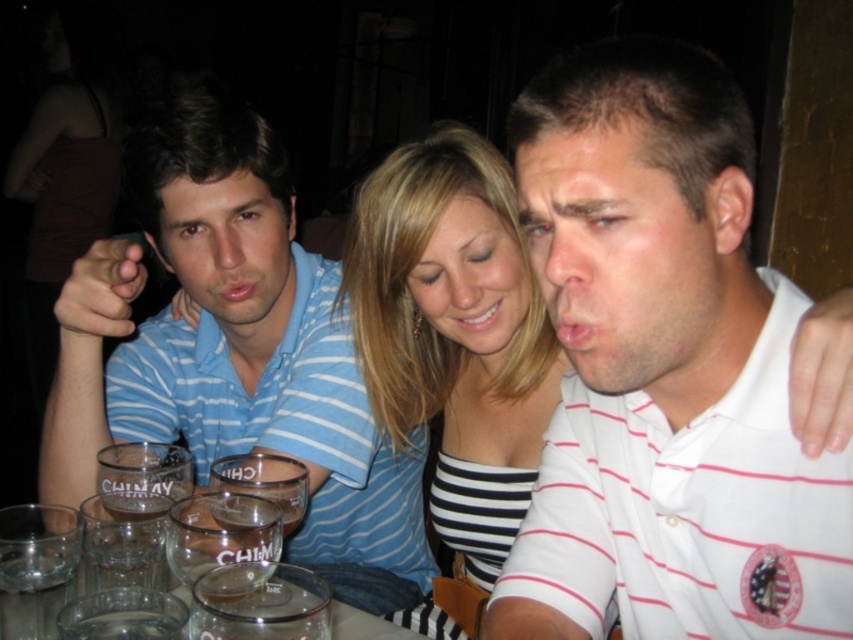
You are a photographer at this gathering. You want to take a photo of the white striped polo shirt at right and the transparent glass at lower left. Which object is wider?

The white striped polo shirt at right is wider than the transparent glass at lower left.

You are a bartender who needs to place a new drink order on the table between the transparent glass at lower left and the clear glass shot glass at lower center. The drink requires 5 inches of space. Can you fit it there?

The transparent glass at lower left and clear glass shot glass at lower center are 4.49 inches apart from each other. Since the required space is 5 inches, the drink cannot be placed there as there is insufficient space.

You are standing at the point labeled point (271, 365) and want to reach the viewer who is 1.22 meters away. Can you walk straight to the viewer without any obstacles?

The point labeled point (271, 365) and the viewer are 1.22 meters apart. Since there are no mentioned obstacles in the scene description, you can walk straight to the viewer without any issues.